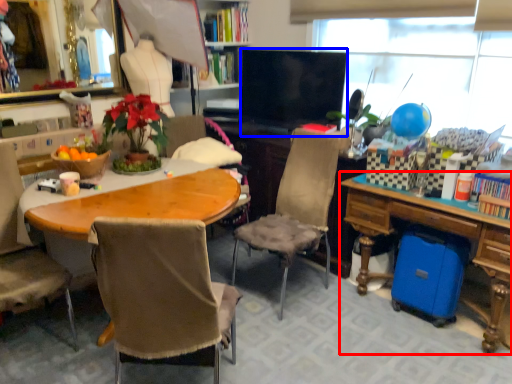
Question: Which of the following is the closest to the observer, desk (highlighted by a red box) or television (highlighted by a blue box)?

Choices:
 (A) desk
 (B) television

Answer: (A)